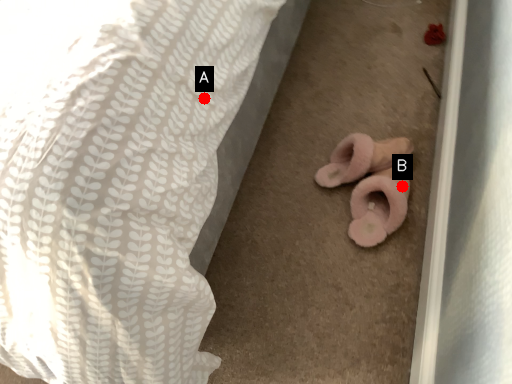
Question: Two points are circled on the image, labeled by A and B beside each circle. Which point appears farthest from the camera in this image?

Choices:
 (A) A is further
 (B) B is further

Answer: (B)